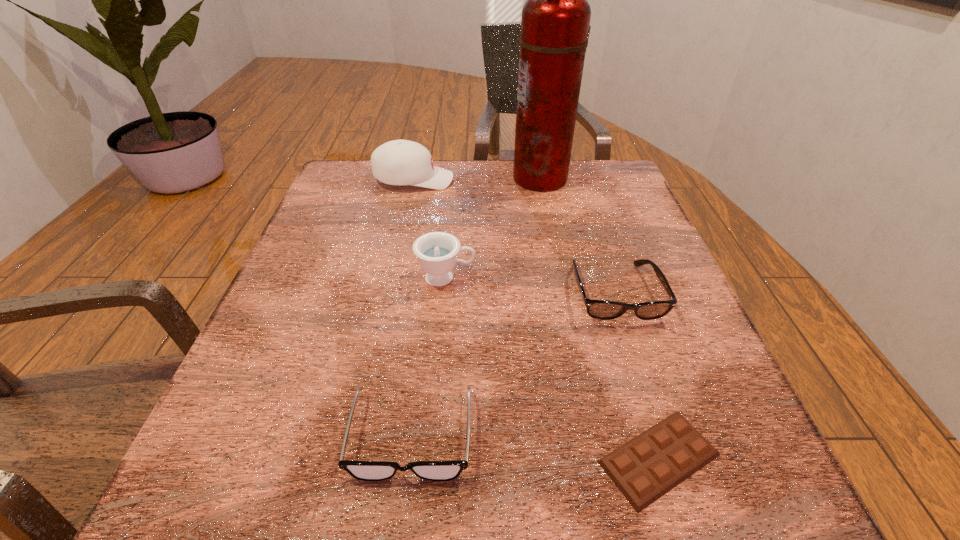
The image size is (960, 540). I want to click on object situated at the left edge, so click(x=399, y=162).

At what (x,y) coordinates should I click in order to perform the action: click on fire extinguisher positioned at the right edge. Please return your answer as a coordinate pair (x, y). The height and width of the screenshot is (540, 960). Looking at the image, I should click on (555, 21).

The height and width of the screenshot is (540, 960). I want to click on spectacles situated at the right edge, so click(598, 309).

At what (x,y) coordinates should I click in order to perform the action: click on chocolate bar present at the right edge. Please return your answer as a coordinate pair (x, y). The width and height of the screenshot is (960, 540). Looking at the image, I should click on (645, 468).

Where is `object that is at the far left corner`? The width and height of the screenshot is (960, 540). object that is at the far left corner is located at coordinates (399, 162).

I want to click on object that is at the far right corner, so click(x=555, y=21).

Find the location of a particular element. object positioned at the near right corner is located at coordinates (645, 468).

You are a GUI agent. You are given a task and a screenshot of the screen. Output one action in this format:
    pyautogui.click(x=<x>, y=<y>)
    Task: Click on the free region at the far edge of the desktop
    This screenshot has height=540, width=960.
    Given the screenshot: What is the action you would take?
    pyautogui.click(x=396, y=194)

Where is `vacant space at the near edge of the desktop`? vacant space at the near edge of the desktop is located at coordinates (501, 484).

Find the location of a particular element. This screenshot has height=540, width=960. blank space at the left edge is located at coordinates (315, 233).